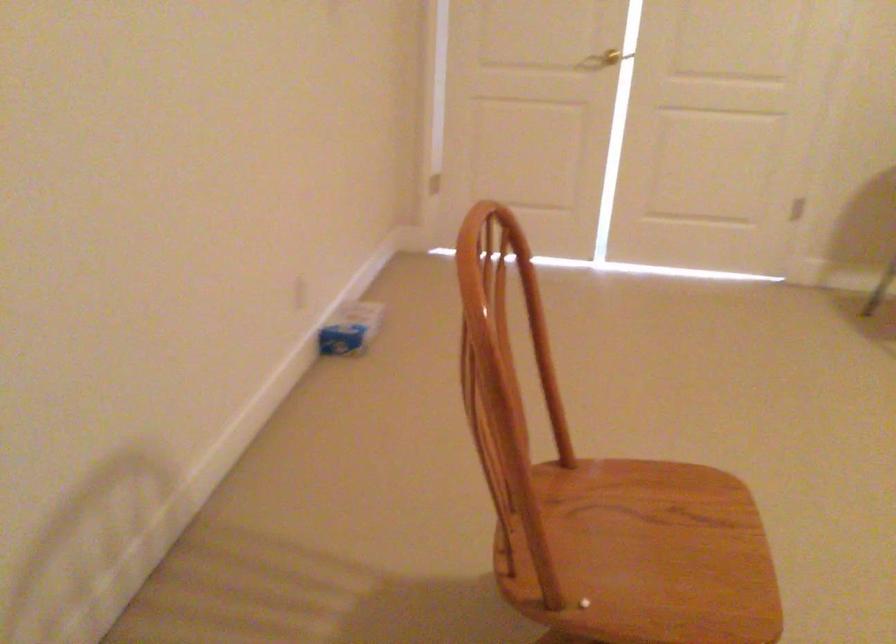
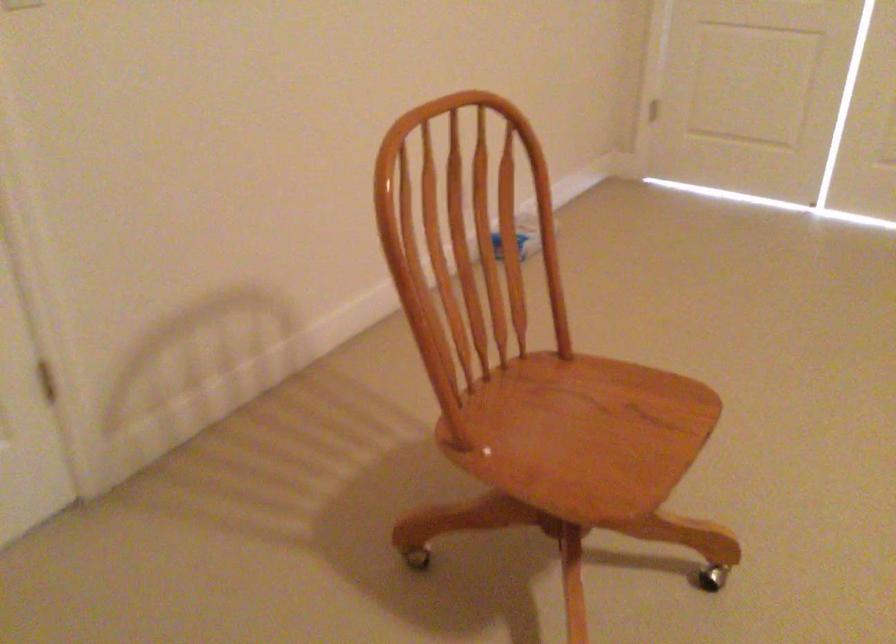
Where in the second image is the point corresponding to (x=632, y=558) from the first image?

(565, 436)